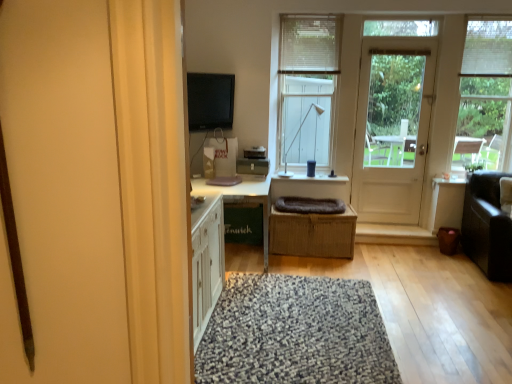
Describe the element at coordinates (309, 44) in the screenshot. I see `white fabric blind at upper center, which is counted as the 2th blind, starting from the right` at that location.

The image size is (512, 384). What do you see at coordinates (295, 333) in the screenshot?
I see `speckled woolen rug at center` at bounding box center [295, 333].

This screenshot has width=512, height=384. What are the coordinates of `white fabric blind at upper right, which is the 1th blind in right-to-left order` in the screenshot? It's located at (488, 48).

What do you see at coordinates (309, 205) in the screenshot?
I see `dark gray plush blanket at center` at bounding box center [309, 205].

In order to click on dark gray plush blanket at center in this screenshot , I will do `click(309, 205)`.

Locate an element on the screen. white fabric blind at upper center, which is counted as the 1th blind, starting from the left is located at coordinates (x=309, y=44).

Considering the relative positions of white plastic lamp at upper center and white fabric blind at upper center, which is counted as the 1th blind, starting from the left, in the image provided, is white plastic lamp at upper center behind white fabric blind at upper center, which is counted as the 1th blind, starting from the left,?

No, it is in front of white fabric blind at upper center, which is counted as the 1th blind, starting from the left.

Could you measure the distance between white plastic lamp at upper center and white fabric blind at upper center, which is counted as the 1th blind, starting from the left?

white plastic lamp at upper center and white fabric blind at upper center, which is counted as the 1th blind, starting from the left, are 24.76 inches apart from each other.

Consider the image. From a real-world perspective, does white plastic lamp at upper center stand above white fabric blind at upper center, which is counted as the 2th blind, starting from the right?

Answer: No, from a real-world perspective, white plastic lamp at upper center is not over white fabric blind at upper center, which is counted as the 2th blind, starting from the right

How many degrees apart are the facing directions of white plastic lamp at upper center and white fabric blind at upper center, which is counted as the 1th blind, starting from the left?

There is a 0.742-degree angle between the facing directions of white plastic lamp at upper center and white fabric blind at upper center, which is counted as the 1th blind, starting from the left.

Is dark gray plush blanket at center not close to woven brown basket at center?

No, there isn't a large distance between dark gray plush blanket at center and woven brown basket at center.

Considering the sizes of objects dark gray plush blanket at center and woven brown basket at center in the image provided, who is bigger, dark gray plush blanket at center or woven brown basket at center?

woven brown basket at center is bigger.

Considering the relative sizes of dark gray plush blanket at center and woven brown basket at center in the image provided, is dark gray plush blanket at center shorter than woven brown basket at center?

Indeed, dark gray plush blanket at center has a lesser height compared to woven brown basket at center.

Find the location of a particular element. The height and width of the screenshot is (384, 512). crate below the dark gray plush blanket at center (from a real-world perspective) is located at coordinates (313, 234).

Considering the positions of objects white plastic lamp at upper center and matte black flat screen tv at upper center in the image provided, who is behind, white plastic lamp at upper center or matte black flat screen tv at upper center?

white plastic lamp at upper center is behind.

Considering the sizes of white plastic lamp at upper center and matte black flat screen tv at upper center in the image, is white plastic lamp at upper center taller or shorter than matte black flat screen tv at upper center?

Considering their sizes, white plastic lamp at upper center has more height than matte black flat screen tv at upper center.

Is white plastic lamp at upper center far from matte black flat screen tv at upper center?

They are positioned close to each other.

Consider the image. Which object is thinner, white plastic lamp at upper center or matte black flat screen tv at upper center?

matte black flat screen tv at upper center.

From the image's perspective, is matte black flat screen tv at upper center below dark gray plush blanket at center?

No, from the image's perspective, matte black flat screen tv at upper center is not beneath dark gray plush blanket at center.

Relative to dark gray plush blanket at center, is matte black flat screen tv at upper center in front or behind?

matte black flat screen tv at upper center is positioned closer to the viewer than dark gray plush blanket at center.

Does point (207, 121) come behind point (294, 209)?

No, (207, 121) is closer to viewer.

Is matte black flat screen tv at upper center wider than dark gray plush blanket at center?

In fact, matte black flat screen tv at upper center might be narrower than dark gray plush blanket at center.

Would you say woven brown basket at center is inside or outside white fabric blind at upper right, which appears as the 2th blind when viewed from the left?

woven brown basket at center is not inside white fabric blind at upper right, which appears as the 2th blind when viewed from the left, it's outside.

Is white fabric blind at upper right, which is the 1th blind in right-to-left order, at the back of woven brown basket at center?

No, woven brown basket at center is not facing away from white fabric blind at upper right, which is the 1th blind in right-to-left order.

Are woven brown basket at center and white fabric blind at upper right, which is the 1th blind in right-to-left order, far apart?

Yes.

Is woven brown basket at center at the left side of white fabric blind at upper right, which appears as the 2th blind when viewed from the left?

Indeed, woven brown basket at center is positioned on the left side of white fabric blind at upper right, which appears as the 2th blind when viewed from the left.

Who is bigger, dark brown leather couch at right or speckled woolen rug at center?

With larger size is dark brown leather couch at right.

Is speckled woolen rug at center at the back of dark brown leather couch at right?

That's not correct — dark brown leather couch at right is not looking away from speckled woolen rug at center.

Considering the points (463, 248) and (231, 287), which point is behind, point (463, 248) or point (231, 287)?

The point (463, 248) is more distant.

Is white plastic lamp at upper center far from white fabric blind at upper right, which appears as the 2th blind when viewed from the left?

white plastic lamp at upper center is far away from white fabric blind at upper right, which appears as the 2th blind when viewed from the left.

Which is closer to the camera, (309, 112) or (506, 23)?

The point (506, 23) is in front.

Identify the location of blind behind the white plastic lamp at upper center. (309, 44).

Find the location of a particular element. crate that appears on the right of dark gray plush blanket at center is located at coordinates (313, 234).

Based on their spatial positions, is white wood window at center, the second window when ordered from right to left, or dark gray plush blanket at center closer to dark brown leather couch at right?

The object closer to dark brown leather couch at right is dark gray plush blanket at center.

Considering their positions, is transparent glass window at upper right, acting as the 2th window starting from the left, positioned closer to matte black flat screen tv at upper center than white fabric blind at upper center, which is counted as the 1th blind, starting from the left?

Among the two, white fabric blind at upper center, which is counted as the 1th blind, starting from the left, is located nearer to matte black flat screen tv at upper center.

Based on their spatial positions, is dark brown leather couch at right or woven brown basket at center closer to speckled woolen rug at center?

woven brown basket at center is closer to speckled woolen rug at center.

Based on their spatial positions, is white wood window at center, the second window when ordered from right to left, or dark brown leather couch at right further from dark gray plush blanket at center?

dark brown leather couch at right is further to dark gray plush blanket at center.

From the image, which object appears to be nearer to transparent glass window at upper right, acting as the 2th window starting from the left, white wooden door at right or speckled woolen rug at center?

white wooden door at right.

Which object lies further to the anchor point dark brown leather couch at right, white plastic lamp at upper center or speckled woolen rug at center?

The object further to dark brown leather couch at right is white plastic lamp at upper center.

Consider the image. From the image, which object appears to be nearer to white fabric blind at upper right, which is the 1th blind in right-to-left order, dark gray plush blanket at center or transparent glass window at upper right, acting as the 2th window starting from the left?

The object closer to white fabric blind at upper right, which is the 1th blind in right-to-left order, is transparent glass window at upper right, acting as the 2th window starting from the left.

Looking at the image, which one is located closer to white wood window at center, which is the first window in left-to-right order, dark gray plush blanket at center or white fabric blind at upper center, which is counted as the 1th blind, starting from the left?

white fabric blind at upper center, which is counted as the 1th blind, starting from the left, lies closer to white wood window at center, which is the first window in left-to-right order, than the other object.

This screenshot has height=384, width=512. I want to click on table between matte black flat screen tv at upper center and white wooden door at right from left to right, so (x=243, y=201).

In order to click on window located between speckled woolen rug at center and transparent glass window at upper right, acting as the 2th window starting from the left, in the left-right direction in this screenshot , I will do `click(307, 85)`.

Identify the location of lamp between white fabric blind at upper right, which appears as the 2th blind when viewed from the left, and speckled woolen rug at center vertically. This screenshot has width=512, height=384. (298, 132).

The height and width of the screenshot is (384, 512). In order to click on window between matte black flat screen tv at upper center and dark brown leather couch at right in this screenshot , I will do `click(307, 85)`.